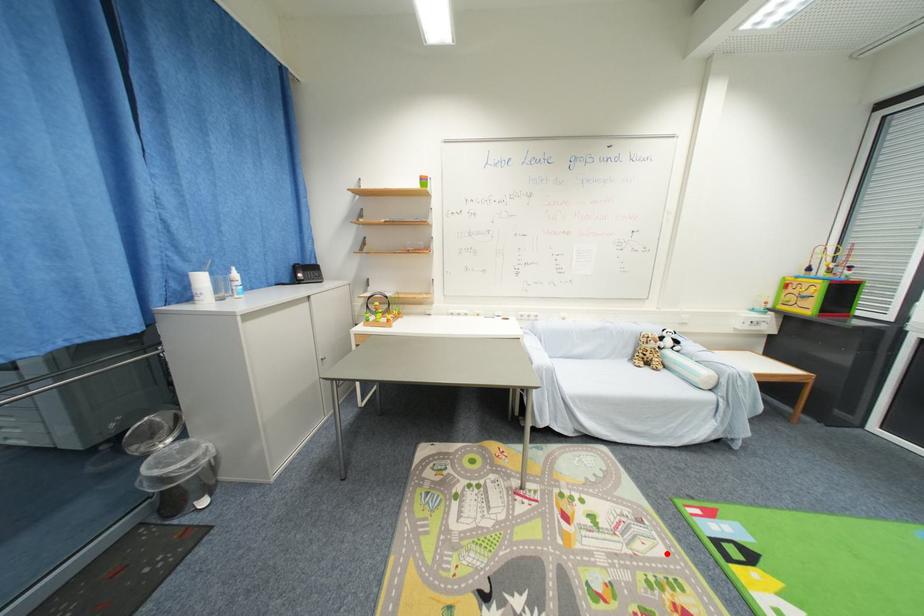
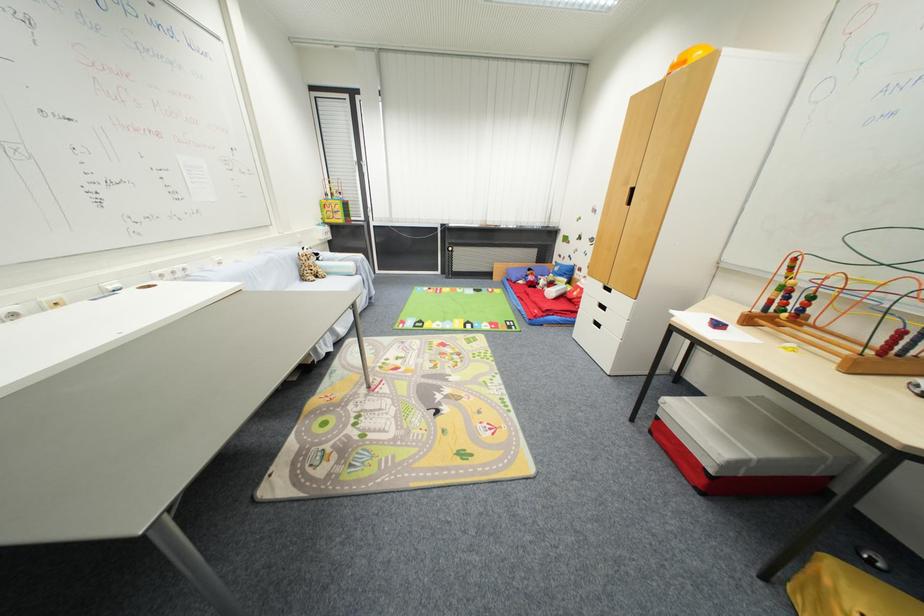
The point at the highlighted location is marked in the first image. Where is the corresponding point in the second image?

(423, 342)